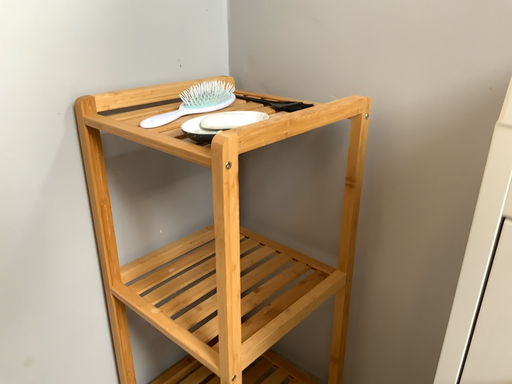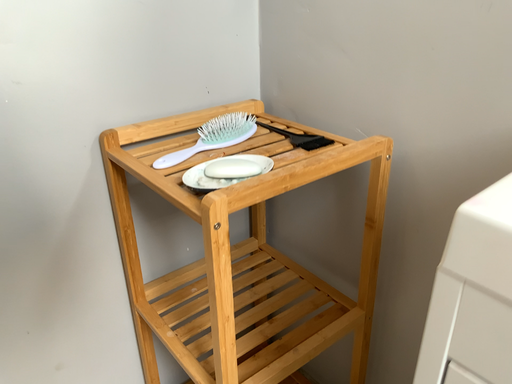
Question: How did the camera likely rotate when shooting the video?

Choices:
 (A) rotated left
 (B) rotated right

Answer: (A)